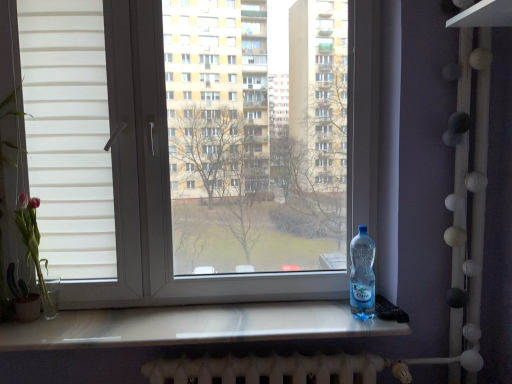
Question: From a real-world perspective, is pink glass vase at left physically located above or below transparent plastic window at center?

Choices:
 (A) above
 (B) below

Answer: (B)

Question: Considering the positions of pink glass vase at left and transparent plastic window at center in the image, is pink glass vase at left wider or thinner than transparent plastic window at center?

Choices:
 (A) thin
 (B) wide

Answer: (B)

Question: Considering the real-world distances, which object is farthest from the transparent plastic window at center?

Choices:
 (A) transparent plastic bottle at right
 (B) pink glass vase at left

Answer: (B)

Question: Which object is the closest to the transparent plastic window at center?

Choices:
 (A) pink glass vase at left
 (B) transparent plastic bottle at right

Answer: (B)